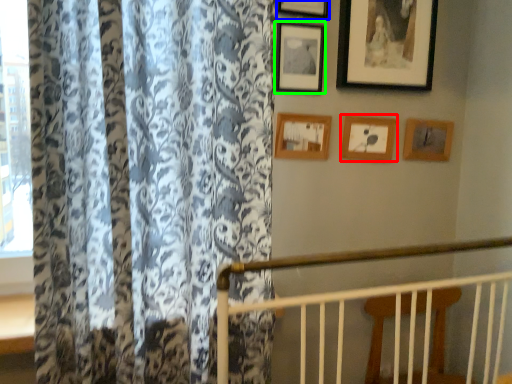
Question: Based on their relative distances, which object is farther from picture frame (highlighted by a red box)? Choose from picture frame (highlighted by a blue box) and picture frame (highlighted by a green box).

Choices:
 (A) picture frame
 (B) picture frame

Answer: (A)